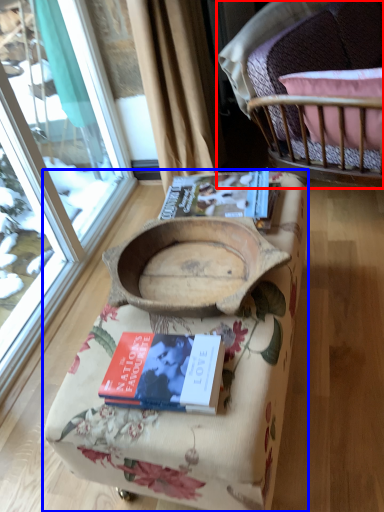
Question: Which of the following is the closest to the observer, chair (highlighted by a red box) or furniture (highlighted by a blue box)?

Choices:
 (A) chair
 (B) furniture

Answer: (B)